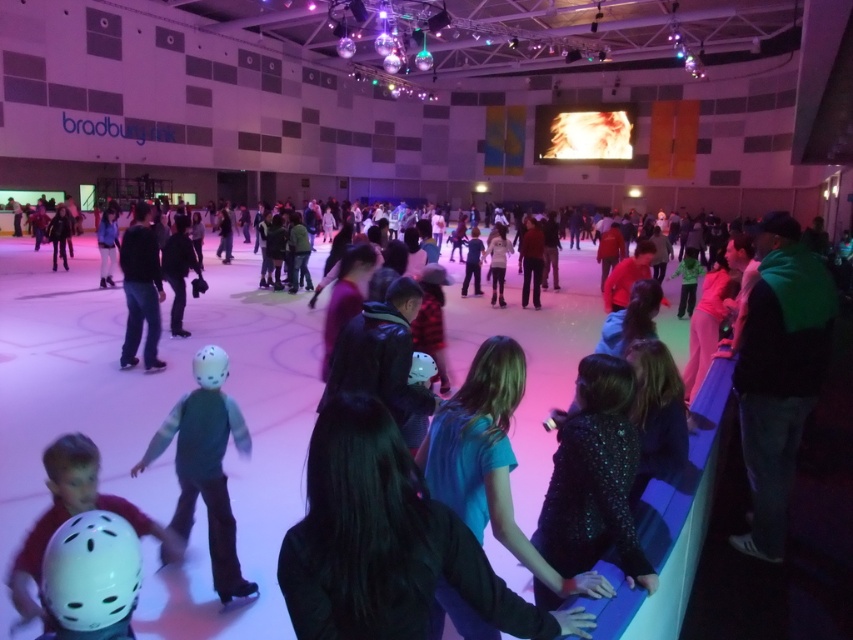
Question: Can you confirm if green fuzzy vest at center is bigger than white matte helmet at lower left?

Choices:
 (A) no
 (B) yes

Answer: (A)

Question: Is green fuzzy vest at center closer to the viewer compared to white matte helmet at lower left?

Choices:
 (A) yes
 (B) no

Answer: (B)

Question: Among these objects, which one is farthest from the camera?

Choices:
 (A) white matte helmet at lower left
 (B) green fuzzy vest at center

Answer: (B)

Question: Does green fuzzy vest at center appear on the left side of white matte helmet at lower left?

Choices:
 (A) yes
 (B) no

Answer: (B)

Question: Which of the following is the closest to the observer?

Choices:
 (A) green fuzzy vest at center
 (B) white matte helmet at lower left

Answer: (B)